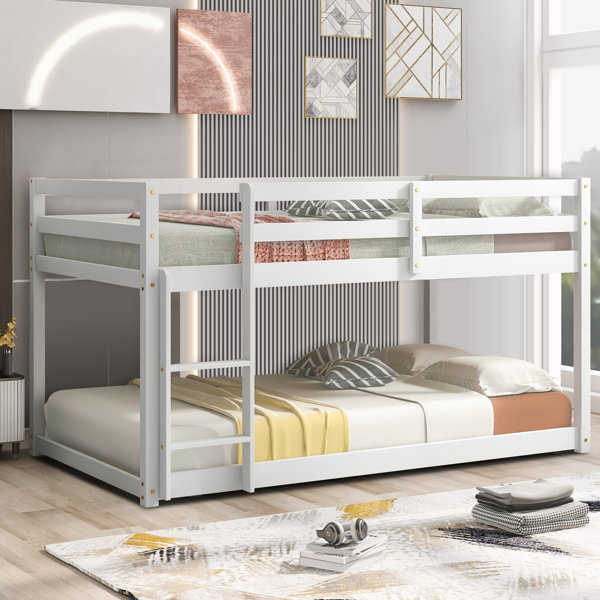
The width and height of the screenshot is (600, 600). I want to click on pillows, so click(x=472, y=362), click(x=407, y=340), click(x=363, y=365), click(x=337, y=339), click(x=364, y=205), click(x=471, y=204).